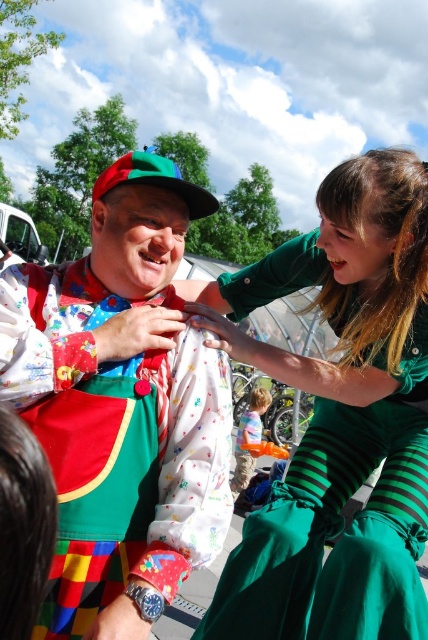
In the scene shown: You are standing at the origin point in the image. Where is the floral fabric clown outfit at center located?

The floral fabric clown outfit at center is located at point 0.636 on the x axis and 0.285 on the y axis.

You are a photographer trying to capture a photo of both the floral fabric clown outfit at center and the green striped dress at center. Which one should you focus on first if you want to capture them from left to right?

The floral fabric clown outfit at center is positioned on the left side of green striped dress at center, so you should focus on the floral fabric clown outfit at center first to capture them from left to right.